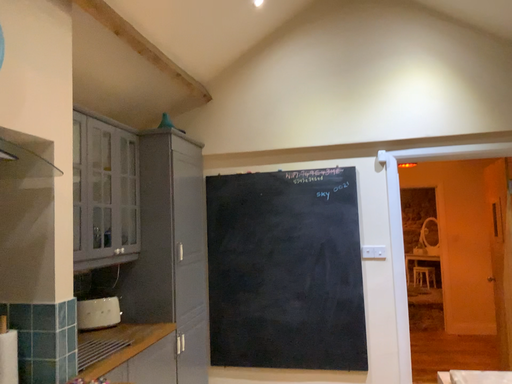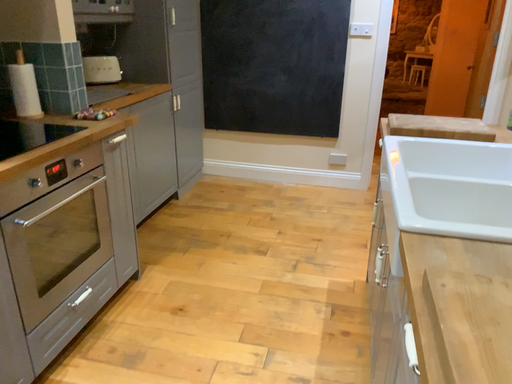
Question: How did the camera likely rotate when shooting the video?

Choices:
 (A) rotated upward
 (B) rotated downward

Answer: (B)